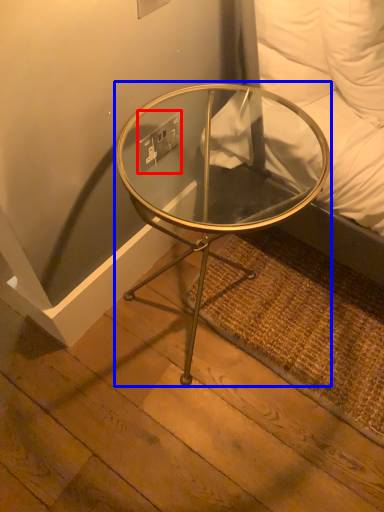
Question: Which object is further to the camera taking this photo, electric outlet (highlighted by a red box) or coffee table (highlighted by a blue box)?

Choices:
 (A) electric outlet
 (B) coffee table

Answer: (A)